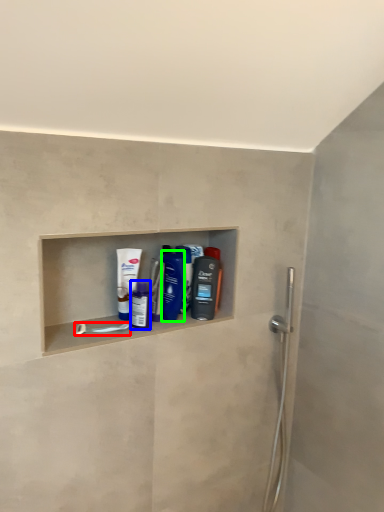
Question: Which object is the closest to the towel bar (highlighted by a red box)? Choose among these: mouthwash (highlighted by a blue box) or mouthwash (highlighted by a green box).

Choices:
 (A) mouthwash
 (B) mouthwash

Answer: (A)